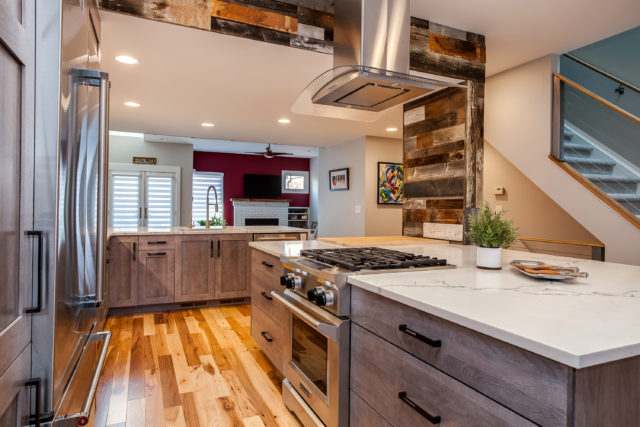
Where is `oven knobs`? The height and width of the screenshot is (427, 640). oven knobs is located at coordinates (283, 280), (298, 282), (314, 294), (326, 300).